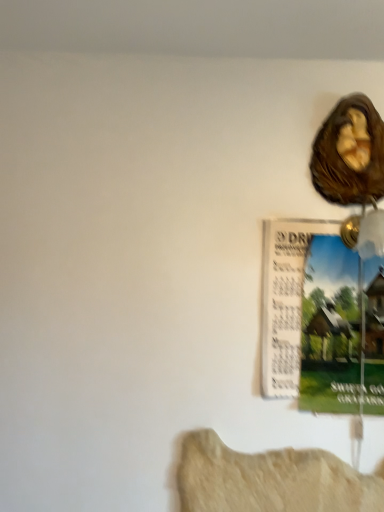
Question: Should I look upward or downward to see matte paper poster at upper right?

Choices:
 (A) up
 (B) down

Answer: (B)

Question: From a real-world perspective, is matte paper poster at upper right physically below brown textured shell at upper right?

Choices:
 (A) yes
 (B) no

Answer: (A)

Question: Is matte paper poster at upper right bigger than brown textured shell at upper right?

Choices:
 (A) no
 (B) yes

Answer: (B)

Question: From the image's perspective, is matte paper poster at upper right over brown textured shell at upper right?

Choices:
 (A) no
 (B) yes

Answer: (A)

Question: Is matte paper poster at upper right aimed at brown textured shell at upper right?

Choices:
 (A) yes
 (B) no

Answer: (B)

Question: Considering the relative sizes of matte paper poster at upper right and brown textured shell at upper right in the image provided, is matte paper poster at upper right thinner than brown textured shell at upper right?

Choices:
 (A) yes
 (B) no

Answer: (A)

Question: Is matte paper poster at upper right positioned in front of brown textured shell at upper right?

Choices:
 (A) yes
 (B) no

Answer: (A)

Question: Does brown textured shell at upper right have a greater height compared to matte paper poster at upper right?

Choices:
 (A) no
 (B) yes

Answer: (A)

Question: From a real-world perspective, is brown textured shell at upper right below matte paper poster at upper right?

Choices:
 (A) no
 (B) yes

Answer: (A)

Question: Is brown textured shell at upper right touching matte paper poster at upper right?

Choices:
 (A) no
 (B) yes

Answer: (A)

Question: Can you confirm if brown textured shell at upper right is positioned to the left of matte paper poster at upper right?

Choices:
 (A) yes
 (B) no

Answer: (B)

Question: From a real-world perspective, is brown textured shell at upper right on matte paper poster at upper right?

Choices:
 (A) no
 (B) yes

Answer: (B)

Question: Considering the relative sizes of brown textured shell at upper right and matte paper poster at upper right in the image provided, is brown textured shell at upper right thinner than matte paper poster at upper right?

Choices:
 (A) yes
 (B) no

Answer: (B)

Question: Considering the positions of brown textured shell at upper right and matte paper poster at upper right in the image, is brown textured shell at upper right taller or shorter than matte paper poster at upper right?

Choices:
 (A) short
 (B) tall

Answer: (A)